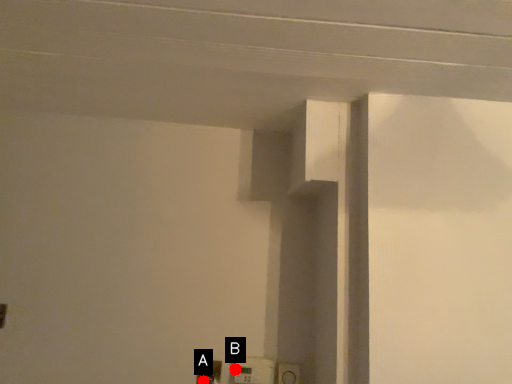
Question: Two points are circled on the image, labeled by A and B beside each circle. Among these points, which one is farthest from the camera?

Choices:
 (A) A is further
 (B) B is further

Answer: (B)